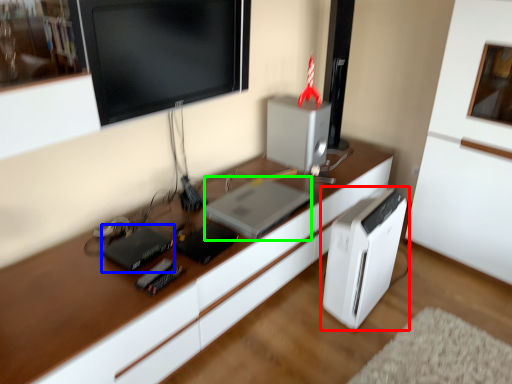
Question: Considering the real-world distances, which object is farthest from home appliance (highlighted by a red box)? appliance (highlighted by a blue box) or computer (highlighted by a green box)?

Choices:
 (A) appliance
 (B) computer

Answer: (A)